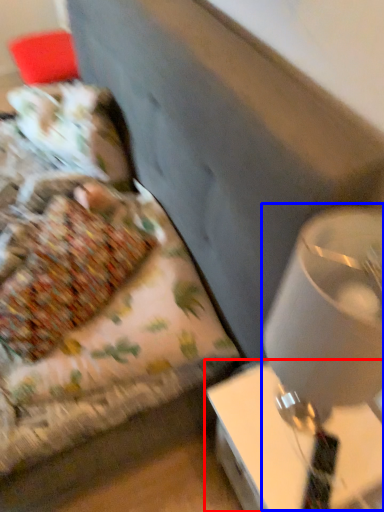
Question: Among these objects, which one is farthest to the camera, table (highlighted by a red box) or table lamp (highlighted by a blue box)?

Choices:
 (A) table
 (B) table lamp

Answer: (A)